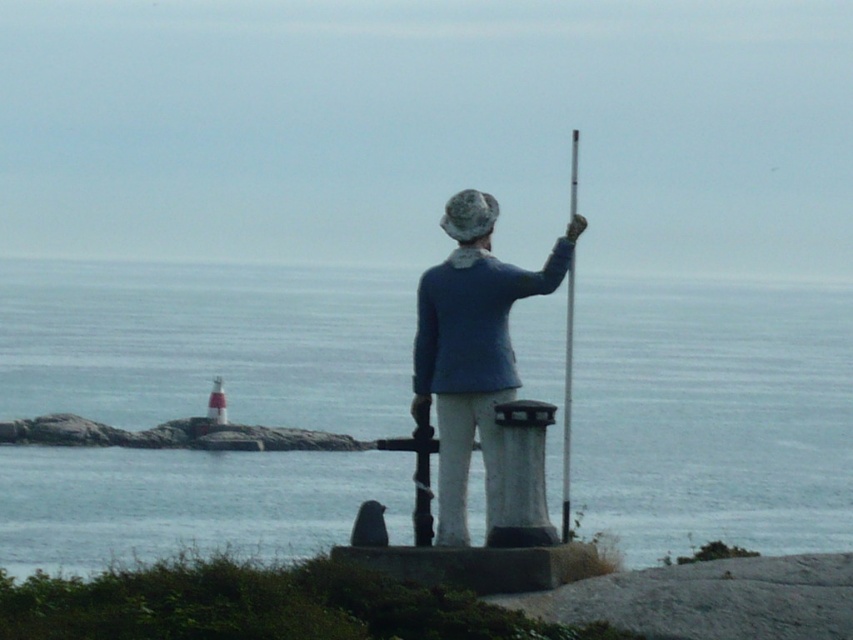
Question: Which is farther from the blue water at center?

Choices:
 (A) metallic pole at center
 (B) blue fabric jacket at center

Answer: (B)

Question: Which of the following is the closest to the observer?

Choices:
 (A) (564, 364)
 (B) (431, 269)

Answer: (B)

Question: Does blue water at center lie in front of blue fabric jacket at center?

Choices:
 (A) no
 (B) yes

Answer: (B)

Question: Which object is positioned farthest from the blue water at center?

Choices:
 (A) metallic pole at center
 (B) blue fabric jacket at center

Answer: (B)

Question: Does blue water at center appear on the right side of metallic pole at center?

Choices:
 (A) yes
 (B) no

Answer: (B)

Question: Does blue fabric jacket at center lie in front of metallic pole at center?

Choices:
 (A) no
 (B) yes

Answer: (B)